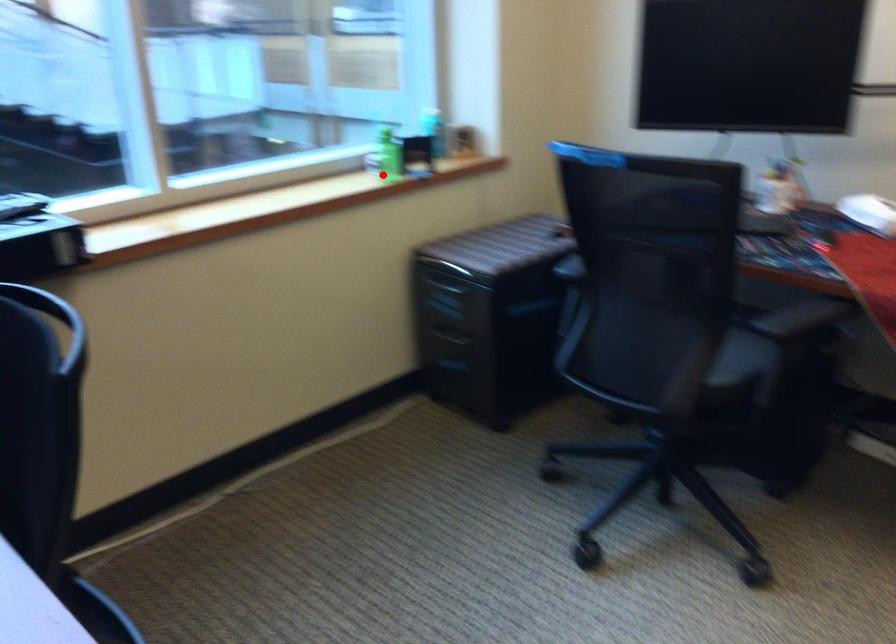
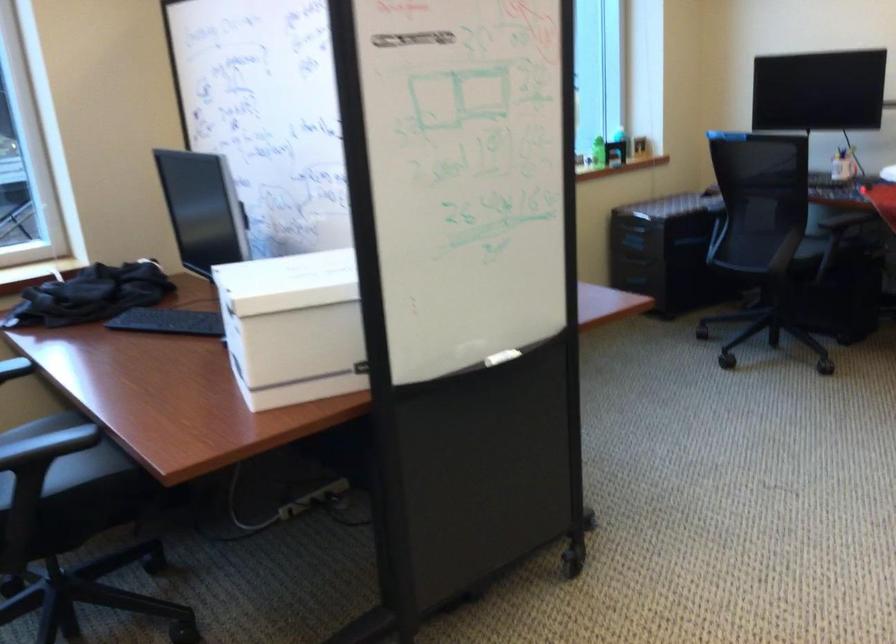
Question: I am providing you with two images of the same scene from different viewpoints. In image1, a red point is highlighted. Considering the same 3D point in image2, which of the following is correct?

Choices:
 (A) It is closer
 (B) It is farther

Answer: (B)